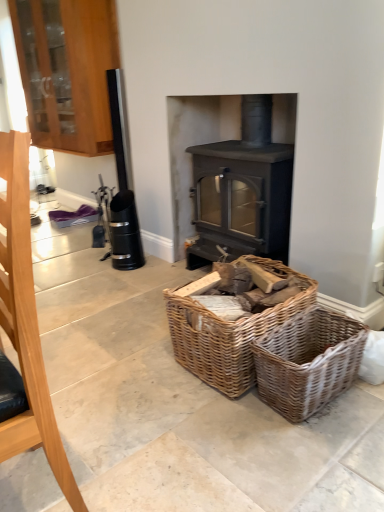
Question: From the image's perspective, is brushed metal fireplace tool at left above or below woven brown basket at lower center?

Choices:
 (A) below
 (B) above

Answer: (B)

Question: Is brushed metal fireplace tool at left to the left or to the right of woven brown basket at lower center in the image?

Choices:
 (A) right
 (B) left

Answer: (B)

Question: Estimate the real-world distances between objects in this image. Which object is closer to the woven wood basket at center?

Choices:
 (A) wooden cabinet at upper left
 (B) woven brown basket at lower center
 (C) matte gray wood burning stove at center
 (D) brushed metal fireplace tool at left

Answer: (B)

Question: Based on their relative distances, which object is nearer to the wooden cabinet at upper left?

Choices:
 (A) brushed metal fireplace tool at left
 (B) matte gray wood burning stove at center
 (C) woven brown basket at lower center
 (D) woven wood basket at center

Answer: (B)